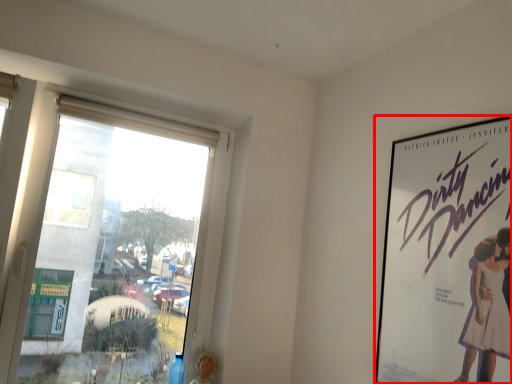
Question: From the image's perspective, where is poster (annotated by the red box) located relative to window?

Choices:
 (A) above
 (B) below

Answer: (B)